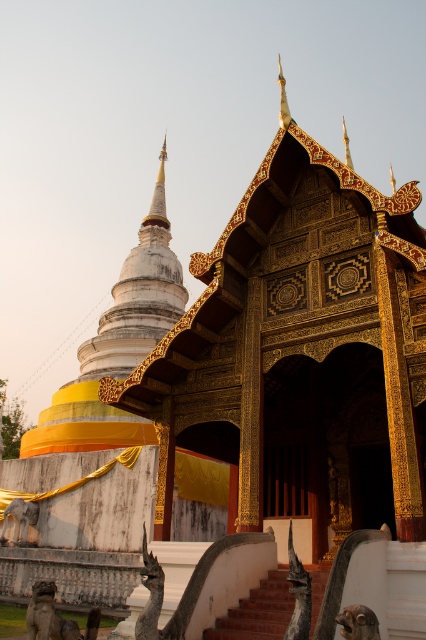
Is terracotta brick stairs at center shorter than shiny metallic monkey at lower center?

In fact, terracotta brick stairs at center may be taller than shiny metallic monkey at lower center.

Does terracotta brick stairs at center have a greater width compared to shiny metallic monkey at lower center?

Correct, the width of terracotta brick stairs at center exceeds that of shiny metallic monkey at lower center.

Is point (245, 620) farther from camera compared to point (348, 637)?

Yes, it is behind point (348, 637).

In order to click on terracotta brick stairs at center in this screenshot , I will do `click(258, 611)`.

Does shiny metallic monkey at lower center appear on the left side of smooth stone dog at lower left?

In fact, shiny metallic monkey at lower center is to the right of smooth stone dog at lower left.

You are a GUI agent. You are given a task and a screenshot of the screen. Output one action in this format:
    pyautogui.click(x=<x>, y=<y>)
    Task: Click on the shiny metallic monkey at lower center
    
    Given the screenshot: What is the action you would take?
    pyautogui.click(x=357, y=621)

I want to click on shiny metallic monkey at lower center, so click(x=357, y=621).

Does shiny bronze statue at lower left have a lesser width compared to shiny metallic monkey at lower center?

No, shiny bronze statue at lower left is not thinner than shiny metallic monkey at lower center.

Between shiny bronze statue at lower left and shiny metallic monkey at lower center, which one has more height?

shiny bronze statue at lower left

This screenshot has width=426, height=640. I want to click on shiny bronze statue at lower left, so click(48, 616).

Locate an element on the screen. shiny bronze statue at lower left is located at coordinates (48, 616).